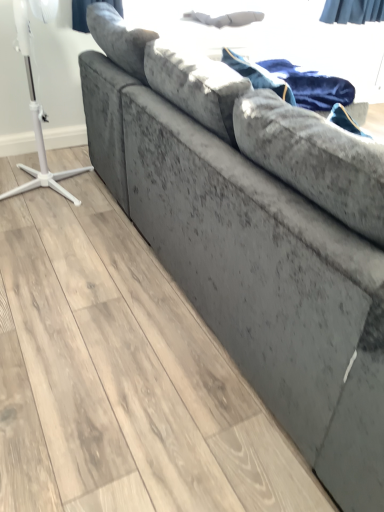
Locate an element on the screen. This screenshot has width=384, height=512. free space underneath white plastic tripod at left (from a real-world perspective) is located at coordinates (38, 187).